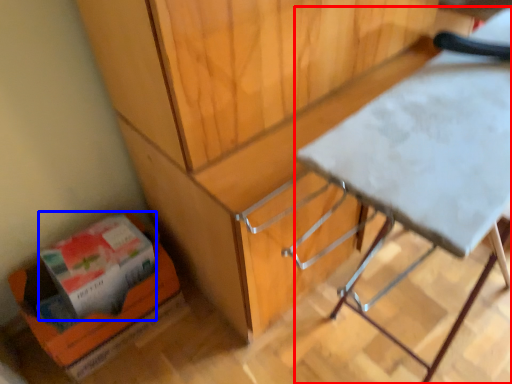
Question: Which object appears closest to the camera in this image, table (highlighted by a red box) or box (highlighted by a blue box)?

Choices:
 (A) table
 (B) box

Answer: (A)